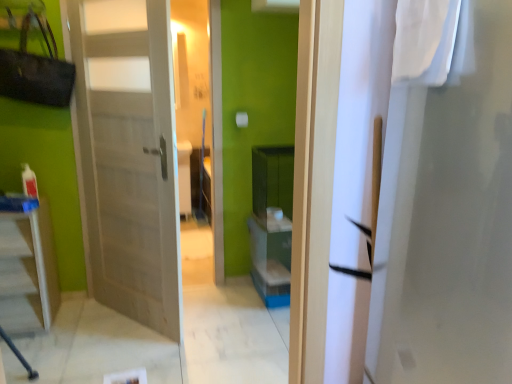
I want to click on white fabric at upper right, so click(433, 42).

The image size is (512, 384). I want to click on white glossy table at lower left, so click(27, 271).

This screenshot has height=384, width=512. What are the coordinates of `white fabric at upper right` in the screenshot? It's located at (433, 42).

Is white glossy table at lower left oriented towards wooden door at left?

No, white glossy table at lower left is not oriented towards wooden door at left.

Is white glossy table at lower left surrounding wooden door at left?

No, wooden door at left is not surrounded by white glossy table at lower left.

From the image's perspective, would you say white glossy table at lower left is shown under wooden door at left?

Yes, from the image's perspective, white glossy table at lower left is beneath wooden door at left.

This screenshot has width=512, height=384. In order to click on furniture lying below the wooden door at left (from the image's perspective) in this screenshot , I will do `click(27, 271)`.

Can you tell me how much white fabric at upper right and white glossy table at lower left differ in facing direction?

The facing directions of white fabric at upper right and white glossy table at lower left are 100 degrees apart.

Considering the positions of objects white fabric at upper right and white glossy table at lower left in the image provided, who is more to the left, white fabric at upper right or white glossy table at lower left?

From the viewer's perspective, white glossy table at lower left appears more on the left side.

Can you confirm if white fabric at upper right is smaller than white glossy table at lower left?

Yes.

Which is in front, point (418, 57) or point (35, 329)?

The point (418, 57) is closer.

Measure the distance between wooden door at left and white glossy table at lower left.

wooden door at left and white glossy table at lower left are 62.50 centimeters apart from each other.

Is wooden door at left thinner than white glossy table at lower left?

Correct, the width of wooden door at left is less than that of white glossy table at lower left.

Is wooden door at left bigger or smaller than white glossy table at lower left?

Considering their sizes, wooden door at left takes up more space than white glossy table at lower left.

From a real-world perspective, is white glossy table at lower left under white fabric at upper right?

Correct, in the physical world, white glossy table at lower left is lower than white fabric at upper right.

From the image's perspective, does white glossy table at lower left appear lower than white fabric at upper right?

Yes, from the image's perspective, white glossy table at lower left is below white fabric at upper right.

Is white glossy table at lower left to the left or to the right of white fabric at upper right in the image?

From the image, it's evident that white glossy table at lower left is to the left of white fabric at upper right.

Is white glossy table at lower left oriented towards white fabric at upper right?

No, white glossy table at lower left is not turned towards white fabric at upper right.

Is white fabric at upper right facing away from wooden door at left?

No, wooden door at left is not at the back of white fabric at upper right.

Does white fabric at upper right have a larger size compared to wooden door at left?

No.

Is white fabric at upper right taller or shorter than wooden door at left?

Clearly, white fabric at upper right is shorter compared to wooden door at left.

From a real-world perspective, is wooden door at left below white fabric at upper right?

Yes, from a real-world perspective, wooden door at left is under white fabric at upper right.

How different are the orientations of wooden door at left and white fabric at upper right in degrees?

38.1 degrees separate the facing orientations of wooden door at left and white fabric at upper right.

Is there a large distance between wooden door at left and white fabric at upper right?

Yes, wooden door at left and white fabric at upper right are located far from each other.

Is wooden door at left looking in the opposite direction of white fabric at upper right?

wooden door at left is not turned away from white fabric at upper right.

The image size is (512, 384). I want to click on furniture behind the wooden door at left, so click(x=27, y=271).

Identify the location of furniture on the left of white fabric at upper right. This screenshot has height=384, width=512. (27, 271).

Estimate the real-world distances between objects in this image. Which object is closer to wooden door at left, white glossy table at lower left or white fabric at upper right?

white glossy table at lower left is positioned closer to the anchor wooden door at left.

Which object lies further to the anchor point white fabric at upper right, white glossy table at lower left or wooden door at left?

white glossy table at lower left lies further to white fabric at upper right than the other object.

Which object lies nearer to the anchor point white glossy table at lower left, white fabric at upper right or wooden door at left?

Among the two, wooden door at left is located nearer to white glossy table at lower left.

From the image, which object appears to be farther from white glossy table at lower left, wooden door at left or white fabric at upper right?

white fabric at upper right is further to white glossy table at lower left.

Looking at this image, which object lies nearer to the anchor point wooden door at left, white fabric at upper right or white glossy table at lower left?

Based on the image, white glossy table at lower left appears to be nearer to wooden door at left.

Considering their positions, is wooden door at left positioned further to white fabric at upper right than white glossy table at lower left?

white glossy table at lower left is further to white fabric at upper right.

This screenshot has width=512, height=384. I want to click on door between white glossy table at lower left and white fabric at upper right, so click(x=129, y=156).